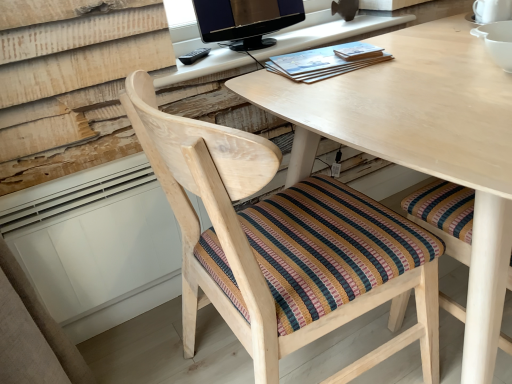
Question: Is matte wooden desk at upper center, which ranks as the second computer desk in bottom-to-top order, positioned with its back to matte black monitor at upper center?

Choices:
 (A) no
 (B) yes

Answer: (A)

Question: Does matte wooden desk at upper center, arranged as the 1th computer desk when viewed from the top, have a smaller size compared to matte black monitor at upper center?

Choices:
 (A) yes
 (B) no

Answer: (B)

Question: Does matte wooden desk at upper center, arranged as the 1th computer desk when viewed from the top, lie in front of matte black monitor at upper center?

Choices:
 (A) no
 (B) yes

Answer: (B)

Question: Is matte wooden desk at upper center, which ranks as the second computer desk in bottom-to-top order, outside matte black monitor at upper center?

Choices:
 (A) no
 (B) yes

Answer: (B)

Question: Can you confirm if matte wooden desk at upper center, which ranks as the second computer desk in bottom-to-top order, is thinner than matte black monitor at upper center?

Choices:
 (A) no
 (B) yes

Answer: (A)

Question: Is blue paperback book at center in front of or behind matte wooden desk at upper center, arranged as the 1th computer desk when viewed from the top, in the image?

Choices:
 (A) behind
 (B) front

Answer: (B)

Question: Is blue paperback book at center bigger or smaller than matte wooden desk at upper center, which ranks as the second computer desk in bottom-to-top order?

Choices:
 (A) small
 (B) big

Answer: (A)

Question: Is point (306, 79) positioned closer to the camera than point (224, 48)?

Choices:
 (A) farther
 (B) closer

Answer: (B)

Question: Is blue paperback book at center taller or shorter than matte wooden desk at upper center, which ranks as the second computer desk in bottom-to-top order?

Choices:
 (A) short
 (B) tall

Answer: (A)

Question: From the image's perspective, is natural wood computer desk at center, which ranks as the 2th computer desk in top-to-bottom order, located above or below matte black monitor at upper center?

Choices:
 (A) above
 (B) below

Answer: (B)

Question: Would you say natural wood computer desk at center, which ranks as the 2th computer desk in top-to-bottom order, is inside or outside matte black monitor at upper center?

Choices:
 (A) outside
 (B) inside

Answer: (A)

Question: Based on their sizes in the image, would you say natural wood computer desk at center, which ranks as the 2th computer desk in top-to-bottom order, is bigger or smaller than matte black monitor at upper center?

Choices:
 (A) small
 (B) big

Answer: (B)

Question: Considering the relative positions of natural wood computer desk at center, which ranks as the first computer desk in bottom-to-top order, and matte black monitor at upper center in the image provided, is natural wood computer desk at center, which ranks as the first computer desk in bottom-to-top order, to the left or to the right of matte black monitor at upper center?

Choices:
 (A) right
 (B) left

Answer: (A)

Question: In the image, is natural wood computer desk at center, which ranks as the 2th computer desk in top-to-bottom order, on the left side or the right side of blue paperback book at center?

Choices:
 (A) right
 (B) left

Answer: (A)

Question: From the image's perspective, is natural wood computer desk at center, which ranks as the first computer desk in bottom-to-top order, positioned above or below blue paperback book at center?

Choices:
 (A) below
 (B) above

Answer: (A)